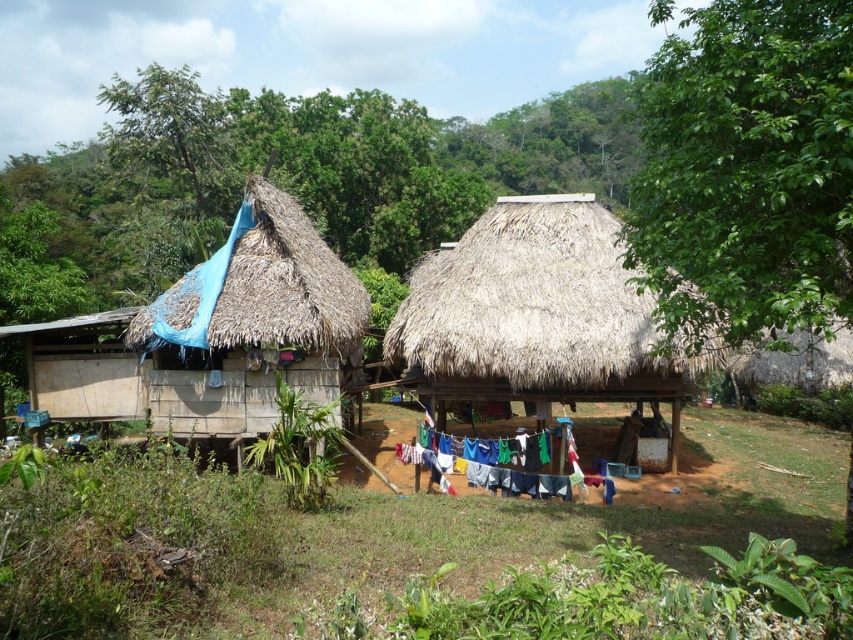
Question: Which point appears farthest from the camera in this image?

Choices:
 (A) (299, 262)
 (B) (598, 209)
 (C) (531, 442)

Answer: (B)

Question: Does brown thatch roof at center have a lesser width compared to multicolored fabric at center?

Choices:
 (A) yes
 (B) no

Answer: (B)

Question: From the image, what is the correct spatial relationship of thatched straw roof at left in relation to multicolored fabric at center?

Choices:
 (A) below
 (B) above

Answer: (B)

Question: Which object is positioned farthest from the brown thatch roof at center?

Choices:
 (A) multicolored fabric at center
 (B) thatched straw roof at left

Answer: (B)

Question: Estimate the real-world distances between objects in this image. Which object is closer to the thatched straw roof at left?

Choices:
 (A) multicolored fabric at center
 (B) brown thatch roof at center

Answer: (A)

Question: Can you confirm if brown thatch roof at center is smaller than multicolored fabric at center?

Choices:
 (A) yes
 (B) no

Answer: (B)